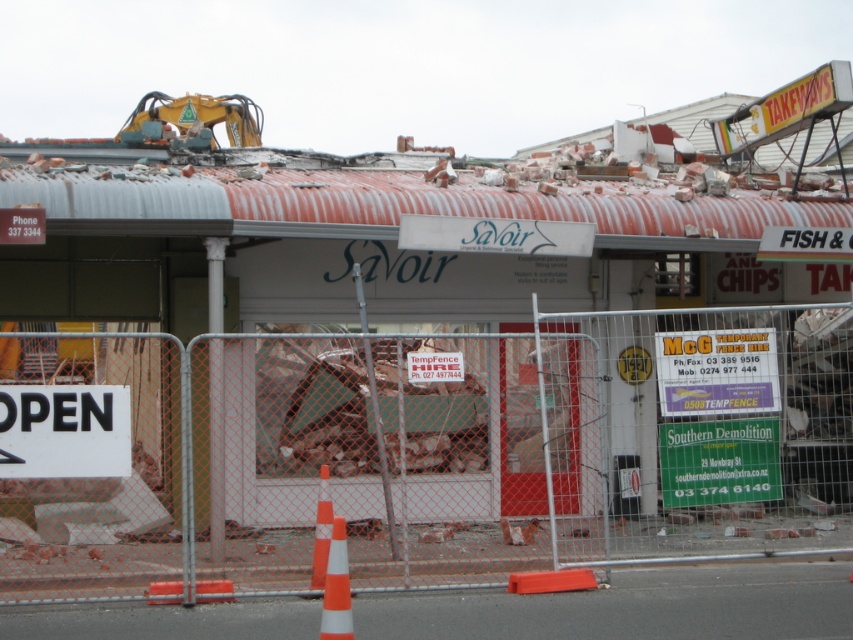
Who is taller, orange chain-link fence at lower left or green plastic sign at lower center?

orange chain-link fence at lower left

Between point (711, 522) and point (683, 480), which one is positioned behind?

Positioned behind is point (711, 522).

Measure the distance between point (212,333) and camera.

Point (212,333) and camera are 35.60 feet apart.

Locate an element on the screen. The height and width of the screenshot is (640, 853). orange chain-link fence at lower left is located at coordinates (416, 456).

In the scene shown: Is green plastic sign at lower center wider than red plastic phone at upper left?

Yes, green plastic sign at lower center is wider than red plastic phone at upper left.

Is point (669, 422) farther from camera compared to point (12, 227)?

Yes, point (669, 422) is behind point (12, 227).

I want to click on green plastic sign at lower center, so click(x=718, y=461).

Who is lower down, orange chain-link fence at lower left or white paper sign at center?

orange chain-link fence at lower left

Does point (631, 490) come in front of point (456, 372)?

No, (631, 490) is further to viewer.

Locate an element on the screen. orange chain-link fence at lower left is located at coordinates (416, 456).